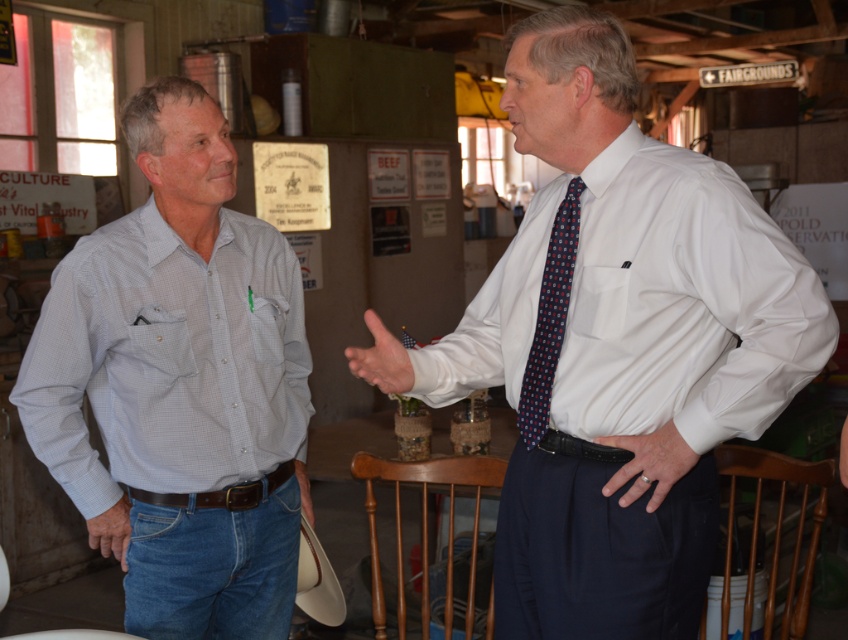
Who is positioned more to the right, white smooth shirt at right or smooth skin hand at center?

Positioned to the right is white smooth shirt at right.

Is white smooth shirt at right to the left of smooth skin hand at center from the viewer's perspective?

No, white smooth shirt at right is not to the left of smooth skin hand at center.

You are a GUI agent. You are given a task and a screenshot of the screen. Output one action in this format:
    pyautogui.click(x=<x>, y=<y>)
    Task: Click on the white smooth shirt at right
    The height and width of the screenshot is (640, 848).
    Given the screenshot: What is the action you would take?
    pyautogui.click(x=682, y=301)

Can you confirm if white smooth shirt at right is thinner than leather glove at lower left?

No, white smooth shirt at right is not thinner than leather glove at lower left.

Between white smooth shirt at right and leather glove at lower left, which one appears on the right side from the viewer's perspective?

From the viewer's perspective, white smooth shirt at right appears more on the right side.

Image resolution: width=848 pixels, height=640 pixels. What do you see at coordinates (682, 301) in the screenshot? I see `white smooth shirt at right` at bounding box center [682, 301].

The width and height of the screenshot is (848, 640). Identify the location of white smooth shirt at right. (682, 301).

Is blue dotted tie at right wider than smooth skin hand at center?

Incorrect, blue dotted tie at right's width does not surpass smooth skin hand at center's.

The height and width of the screenshot is (640, 848). Identify the location of blue dotted tie at right. (550, 317).